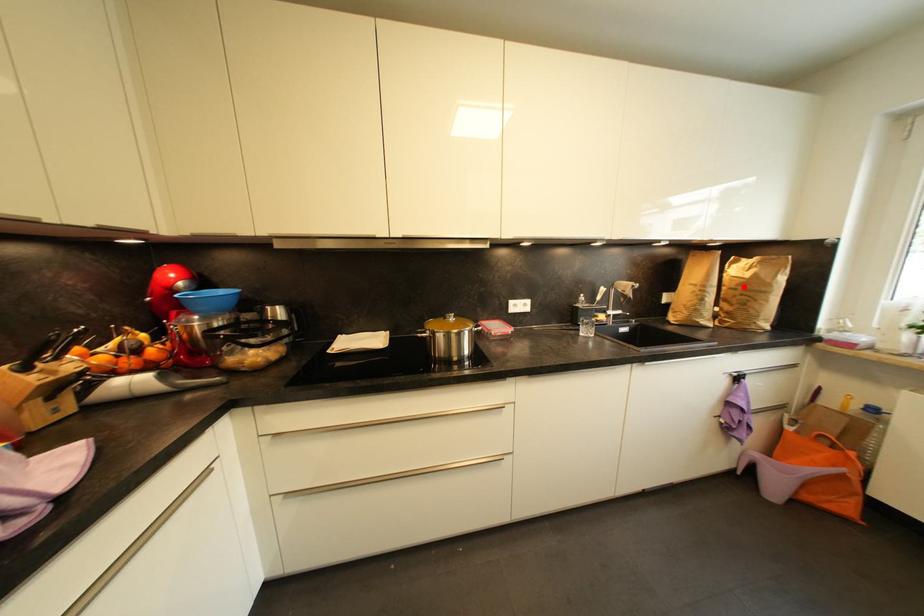
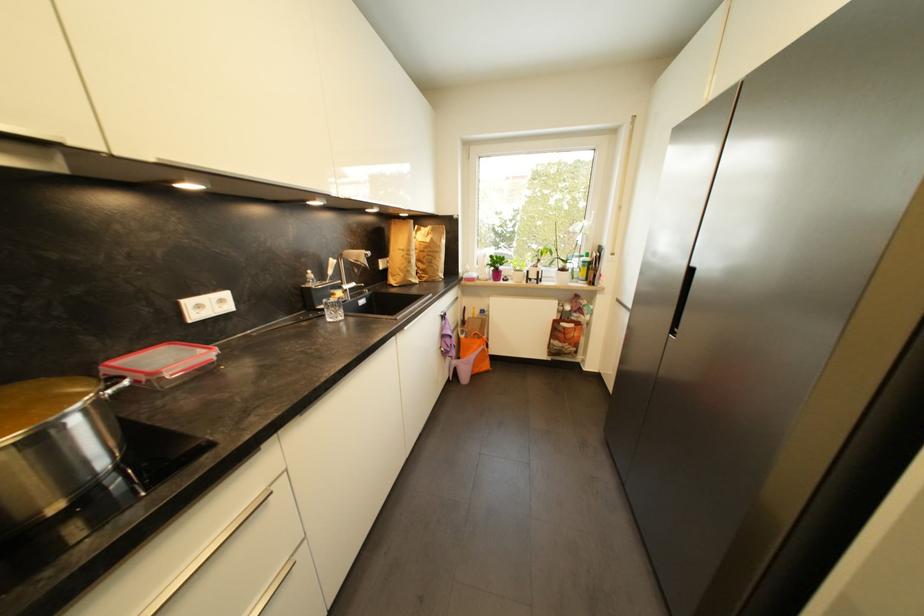
In the second image, find the point that corresponds to the highlighted location in the first image.

(430, 249)